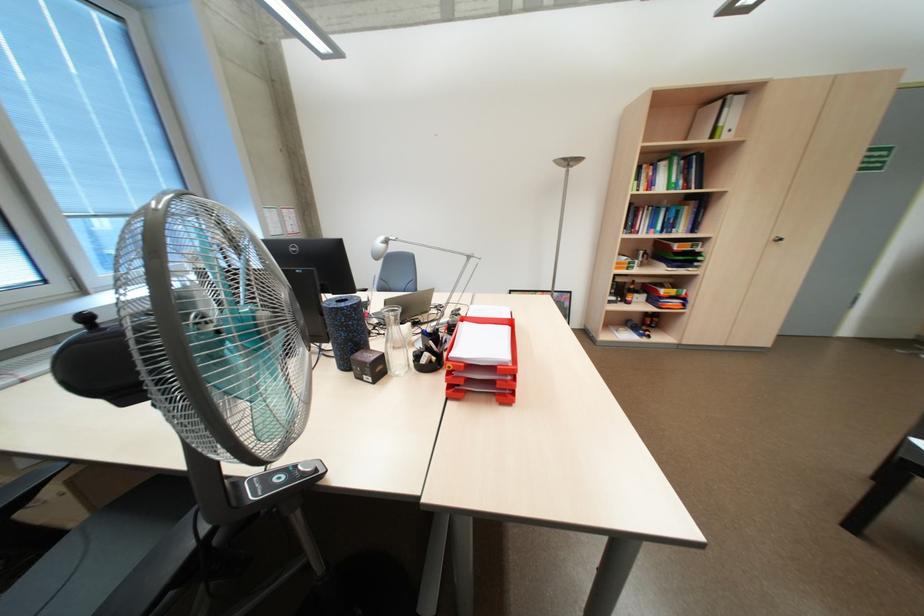
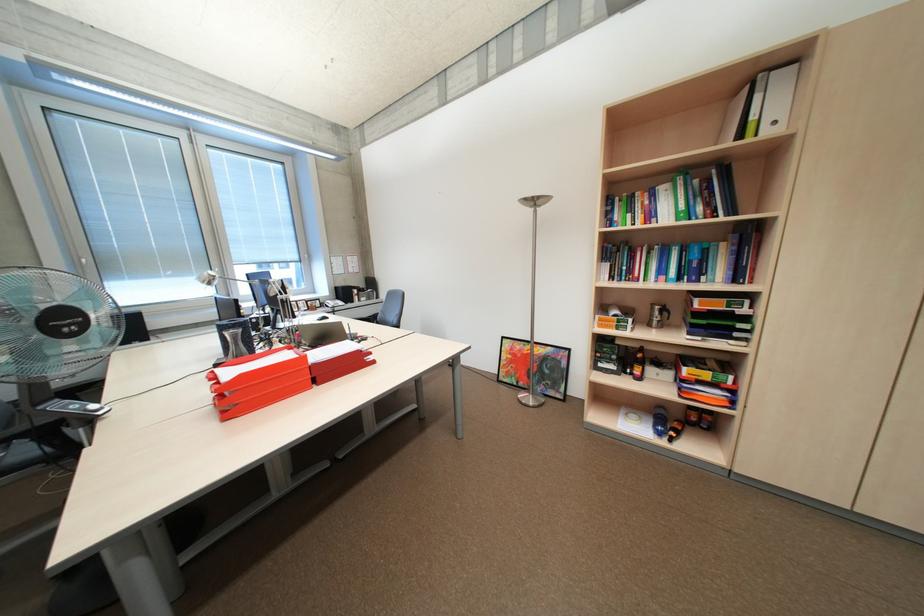
In the second image, find the point that corresponds to the point at 648,249 in the first image.

(663, 304)